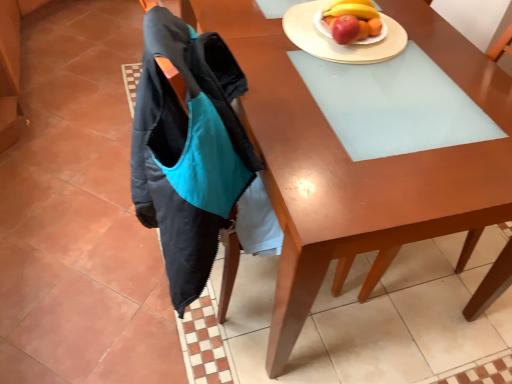
Question: Choose the correct answer: Is matte wood chair at upper right inside white glossy plate at upper right, arranged as the second plate when viewed from the left, or outside it?

Choices:
 (A) inside
 (B) outside

Answer: (B)

Question: Is point (352, 216) closer or farther from the camera than point (375, 41)?

Choices:
 (A) closer
 (B) farther

Answer: (A)

Question: Which of these objects is positioned farthest from the matte wood chair at upper right?

Choices:
 (A) wooden desk at center
 (B) white glossy plate at upper right, arranged as the second plate when viewed from the left
 (C) wooden plate at upper right, the second plate when ordered from right to left

Answer: (B)

Question: Which object is positioned farthest from the white glossy plate at upper right, arranged as the second plate when viewed from the left?

Choices:
 (A) wooden desk at center
 (B) matte wood chair at upper right
 (C) wooden plate at upper right, placed as the 1th plate when sorted from left to right

Answer: (A)